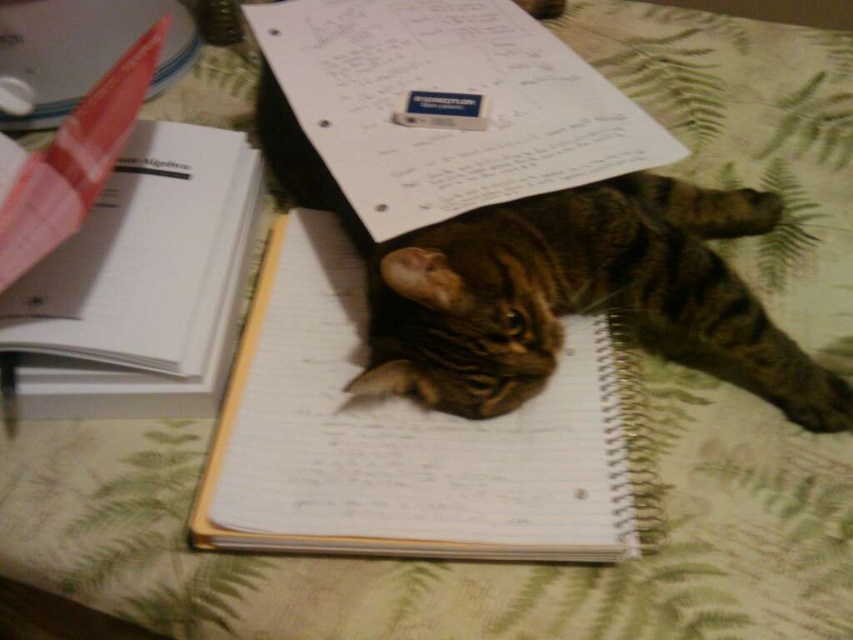
You are organizing a desk and need to know which item is bigger between the white paper at center and the white paper notebook at upper left. Can you tell me?

The white paper at center is larger in size than the white paper notebook at upper left.

You are organizing a space for a new pet. You have a tabby fur cat at center and a white paper notebook at upper left. Which object takes up more space?

The tabby fur cat at center takes up more space because it is bigger than the white paper notebook at upper left.

Looking at this image, you are trying to place a small toy mouse exactly where the tabby fur cat at center is currently lying. According to the coordinates provided, what are the coordinates where you should place the toy mouse?

The coordinates for placing the toy mouse should be at point [581,298], as that is where the tabby fur cat at center is located.